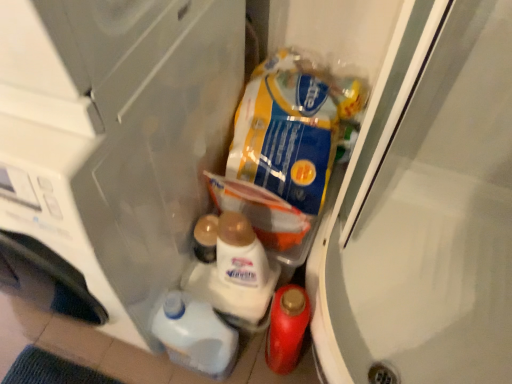
What do you see at coordinates (242, 270) in the screenshot? Image resolution: width=512 pixels, height=384 pixels. I see `white glossy lotion at center, which is counted as the second snack, starting from the bottom` at bounding box center [242, 270].

Locate an element on the screen. The width and height of the screenshot is (512, 384). matte plastic bottle at lower right is located at coordinates (287, 328).

Find the location of a particular element. This screenshot has height=384, width=512. transparent plastic container at lower center is located at coordinates (116, 137).

I want to click on transparent plastic screen door at upper right, so click(x=425, y=212).

Where is `white glossy lotion at center, the second snack from the top`? This screenshot has height=384, width=512. white glossy lotion at center, the second snack from the top is located at coordinates (242, 270).

From their relative heights in the image, would you say transparent plastic container at lower center is taller or shorter than white glossy lotion at center, which is counted as the second snack, starting from the bottom?

Clearly, transparent plastic container at lower center is taller compared to white glossy lotion at center, which is counted as the second snack, starting from the bottom.

Is transparent plastic container at lower center facing away from white glossy lotion at center, the second snack from the top?

No, transparent plastic container at lower center's orientation is not away from white glossy lotion at center, the second snack from the top.

Is the position of transparent plastic container at lower center less distant than that of white glossy lotion at center, the second snack from the top?

Yes, transparent plastic container at lower center is closer to the viewer.

Can you confirm if transparent plastic screen door at upper right is shorter than blue/yellow plastic bag at upper right, the first snack from the top?

Indeed, transparent plastic screen door at upper right has a lesser height compared to blue/yellow plastic bag at upper right, the first snack from the top.

Based on the photo, from a real-world perspective, is transparent plastic screen door at upper right physically above blue/yellow plastic bag at upper right, the first snack from the top?

No, from a real-world perspective, transparent plastic screen door at upper right is not above blue/yellow plastic bag at upper right, the first snack from the top.

Is transparent plastic screen door at upper right next to blue/yellow plastic bag at upper right, the first snack from the top, and touching it?

There is a gap between transparent plastic screen door at upper right and blue/yellow plastic bag at upper right, the first snack from the top.

Is point (468, 265) behind point (312, 182)?

Yes, it is.

Can you confirm if white glossy liquid at lower center, placed as the third snack when sorted from top to bottom, is taller than matte plastic bottle at lower right?

Correct, white glossy liquid at lower center, placed as the third snack when sorted from top to bottom, is much taller as matte plastic bottle at lower right.

Consider the image. Considering the relative positions of white glossy liquid at lower center, the first snack ordered from the bottom, and matte plastic bottle at lower right in the image provided, is white glossy liquid at lower center, the first snack ordered from the bottom, to the left of matte plastic bottle at lower right from the viewer's perspective?

Correct, you'll find white glossy liquid at lower center, the first snack ordered from the bottom, to the left of matte plastic bottle at lower right.

In the scene shown: Which object is thinner, white glossy liquid at lower center, the first snack ordered from the bottom, or matte plastic bottle at lower right?

matte plastic bottle at lower right.

From the image's perspective, which object appears higher, white glossy liquid at lower center, placed as the third snack when sorted from top to bottom, or matte plastic bottle at lower right?

white glossy liquid at lower center, placed as the third snack when sorted from top to bottom, from the image's perspective.

Can you confirm if transparent plastic screen door at upper right is taller than white glossy lotion at center, the second snack from the top?

Incorrect, the height of transparent plastic screen door at upper right is not larger of that of white glossy lotion at center, the second snack from the top.

Can you tell me how much transparent plastic screen door at upper right and white glossy lotion at center, which is counted as the second snack, starting from the bottom, differ in facing direction?

The angle between the facing direction of transparent plastic screen door at upper right and the facing direction of white glossy lotion at center, which is counted as the second snack, starting from the bottom, is 90 degrees.

Could you tell me if transparent plastic screen door at upper right is turned towards white glossy lotion at center, which is counted as the second snack, starting from the bottom?

No, transparent plastic screen door at upper right is not aimed at white glossy lotion at center, which is counted as the second snack, starting from the bottom.

From the image's perspective, between transparent plastic screen door at upper right and white glossy lotion at center, which is counted as the second snack, starting from the bottom, who is located below?

transparent plastic screen door at upper right.

Would you say matte plastic bottle at lower right is to the left or to the right of blue/yellow plastic bag at upper right, which is the 3th snack in bottom-to-top order, in the picture?

matte plastic bottle at lower right is positioned on blue/yellow plastic bag at upper right, which is the 3th snack in bottom-to-top order,'s left side.

Is matte plastic bottle at lower right located outside blue/yellow plastic bag at upper right, which is the 3th snack in bottom-to-top order?

matte plastic bottle at lower right lies outside blue/yellow plastic bag at upper right, which is the 3th snack in bottom-to-top order,'s area.

Is point (272, 310) less distant than point (345, 77)?

Yes, point (272, 310) is in front of point (345, 77).

Considering the sizes of objects matte plastic bottle at lower right and blue/yellow plastic bag at upper right, which is the 3th snack in bottom-to-top order, in the image provided, who is taller, matte plastic bottle at lower right or blue/yellow plastic bag at upper right, which is the 3th snack in bottom-to-top order,?

Standing taller between the two is matte plastic bottle at lower right.

Considering the sizes of objects matte plastic bottle at lower right and white glossy liquid at lower center, placed as the third snack when sorted from top to bottom, in the image provided, who is thinner, matte plastic bottle at lower right or white glossy liquid at lower center, placed as the third snack when sorted from top to bottom,?

With smaller width is matte plastic bottle at lower right.

From a real-world perspective, does matte plastic bottle at lower right stand above white glossy liquid at lower center, placed as the third snack when sorted from top to bottom?

Correct, in the physical world, matte plastic bottle at lower right is higher than white glossy liquid at lower center, placed as the third snack when sorted from top to bottom.

Measure the distance from matte plastic bottle at lower right to white glossy liquid at lower center, the first snack ordered from the bottom.

matte plastic bottle at lower right is 6.71 inches from white glossy liquid at lower center, the first snack ordered from the bottom.

There is a white glossy liquid at lower center, placed as the third snack when sorted from top to bottom. Where is `bottle above it (from a real-world perspective)`? bottle above it (from a real-world perspective) is located at coordinates (287, 328).

Is blue/yellow plastic bag at upper right, the first snack from the top, facing away from transparent plastic screen door at upper right?

blue/yellow plastic bag at upper right, the first snack from the top, is not turned away from transparent plastic screen door at upper right.

Considering the relative sizes of blue/yellow plastic bag at upper right, which is the 3th snack in bottom-to-top order, and transparent plastic screen door at upper right in the image provided, is blue/yellow plastic bag at upper right, which is the 3th snack in bottom-to-top order, thinner than transparent plastic screen door at upper right?

Indeed, blue/yellow plastic bag at upper right, which is the 3th snack in bottom-to-top order, has a lesser width compared to transparent plastic screen door at upper right.

Measure the distance from blue/yellow plastic bag at upper right, the first snack from the top, to transparent plastic screen door at upper right.

blue/yellow plastic bag at upper right, the first snack from the top, and transparent plastic screen door at upper right are 11.13 inches apart.

You are a GUI agent. You are given a task and a screenshot of the screen. Output one action in this format:
    pyautogui.click(x=<x>, y=<y>)
    Task: Click on the screen door directly beneath the blue/yellow plastic bag at upper right, the first snack from the top (from a real-world perspective)
    This screenshot has height=384, width=512.
    Given the screenshot: What is the action you would take?
    pyautogui.click(x=425, y=212)

From the image's perspective, count 1st snacks downward from the transparent plastic container at lower center and point to it. Please provide its 2D coordinates.

[(242, 270)]

Image resolution: width=512 pixels, height=384 pixels. Find the location of `the 3rd snack above the transparent plastic screen door at upper right (from a real-world perspective)`. the 3rd snack above the transparent plastic screen door at upper right (from a real-world perspective) is located at coordinates (292, 127).

In the scene shown: Estimate the real-world distances between objects in this image. Which object is closer to blue/yellow plastic bag at upper right, the first snack from the top, transparent plastic container at lower center or transparent plastic screen door at upper right?

transparent plastic screen door at upper right.

Consider the image. Based on their spatial positions, is white glossy lotion at center, which is counted as the second snack, starting from the bottom, or white glossy liquid at lower center, the first snack ordered from the bottom, closer to matte plastic bottle at lower right?

Based on the image, white glossy lotion at center, which is counted as the second snack, starting from the bottom, appears to be nearer to matte plastic bottle at lower right.

From the image, which object appears to be farther from white glossy liquid at lower center, placed as the third snack when sorted from top to bottom, blue/yellow plastic bag at upper right, the first snack from the top, or white glossy lotion at center, which is counted as the second snack, starting from the bottom?

blue/yellow plastic bag at upper right, the first snack from the top, is positioned further to the anchor white glossy liquid at lower center, placed as the third snack when sorted from top to bottom.

When comparing their distances from white glossy liquid at lower center, the first snack ordered from the bottom, does transparent plastic screen door at upper right or matte plastic bottle at lower right seem closer?

matte plastic bottle at lower right is positioned closer to the anchor white glossy liquid at lower center, the first snack ordered from the bottom.

Estimate the real-world distances between objects in this image. Which object is further from transparent plastic screen door at upper right, white glossy liquid at lower center, the first snack ordered from the bottom, or blue/yellow plastic bag at upper right, the first snack from the top?

white glossy liquid at lower center, the first snack ordered from the bottom, lies further to transparent plastic screen door at upper right than the other object.

Which object lies further to the anchor point transparent plastic screen door at upper right, matte plastic bottle at lower right or transparent plastic container at lower center?

Among the two, transparent plastic container at lower center is located further to transparent plastic screen door at upper right.

Considering their positions, is blue/yellow plastic bag at upper right, which is the 3th snack in bottom-to-top order, positioned further to transparent plastic screen door at upper right than white glossy lotion at center, which is counted as the second snack, starting from the bottom?

Among the two, white glossy lotion at center, which is counted as the second snack, starting from the bottom, is located further to transparent plastic screen door at upper right.

From the image, which object appears to be nearer to matte plastic bottle at lower right, transparent plastic screen door at upper right or blue/yellow plastic bag at upper right, the first snack from the top?

Among the two, transparent plastic screen door at upper right is located nearer to matte plastic bottle at lower right.

You are a GUI agent. You are given a task and a screenshot of the screen. Output one action in this format:
    pyautogui.click(x=<x>, y=<y>)
    Task: Click on the bottle between white glossy lotion at center, the second snack from the top, and transparent plastic screen door at upper right from left to right
    
    Given the screenshot: What is the action you would take?
    pyautogui.click(x=287, y=328)

Locate an element on the screen. The height and width of the screenshot is (384, 512). snack located between white glossy lotion at center, the second snack from the top, and transparent plastic screen door at upper right in the left-right direction is located at coordinates (292, 127).

Where is `snack between white glossy lotion at center, the second snack from the top, and matte plastic bottle at lower right in the up-down direction`? snack between white glossy lotion at center, the second snack from the top, and matte plastic bottle at lower right in the up-down direction is located at coordinates (195, 336).

Locate an element on the screen. This screenshot has height=384, width=512. bottle between transparent plastic container at lower center and blue/yellow plastic bag at upper right, which is the 3th snack in bottom-to-top order, from left to right is located at coordinates (287, 328).